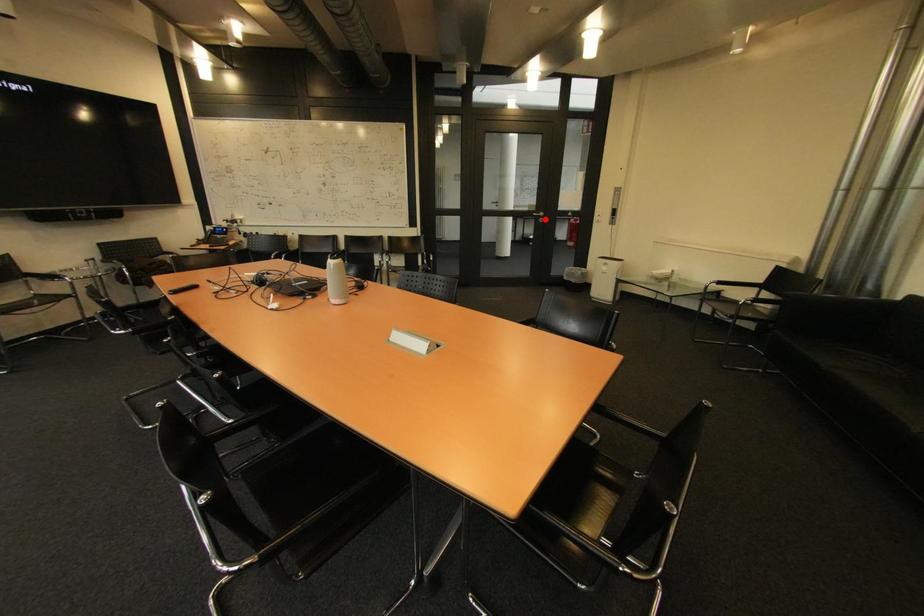
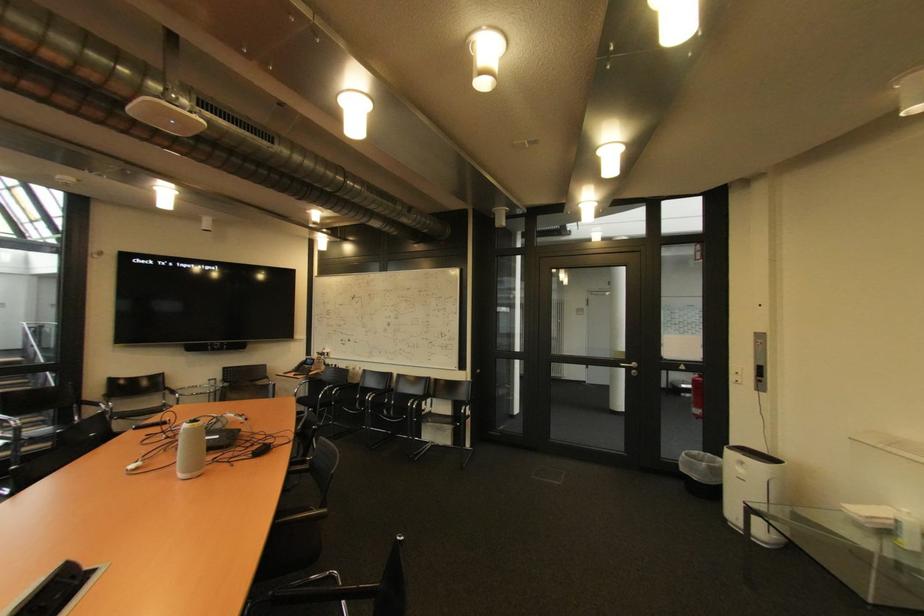
Locate, in the second image, the point that corresponds to the highlighted location in the first image.

(637, 371)